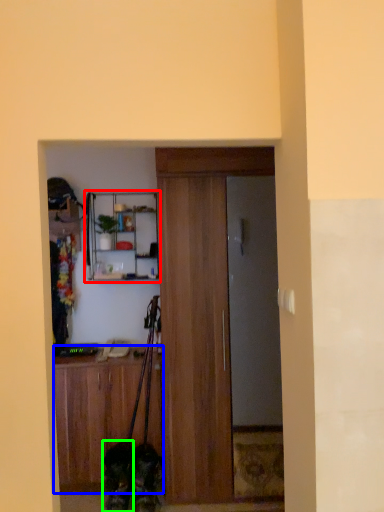
Question: Estimate the real-world distances between objects in this image. Which object is closer to shelf (highlighted by a red box), cabinetry (highlighted by a blue box) or dog (highlighted by a green box)?

Choices:
 (A) cabinetry
 (B) dog

Answer: (A)